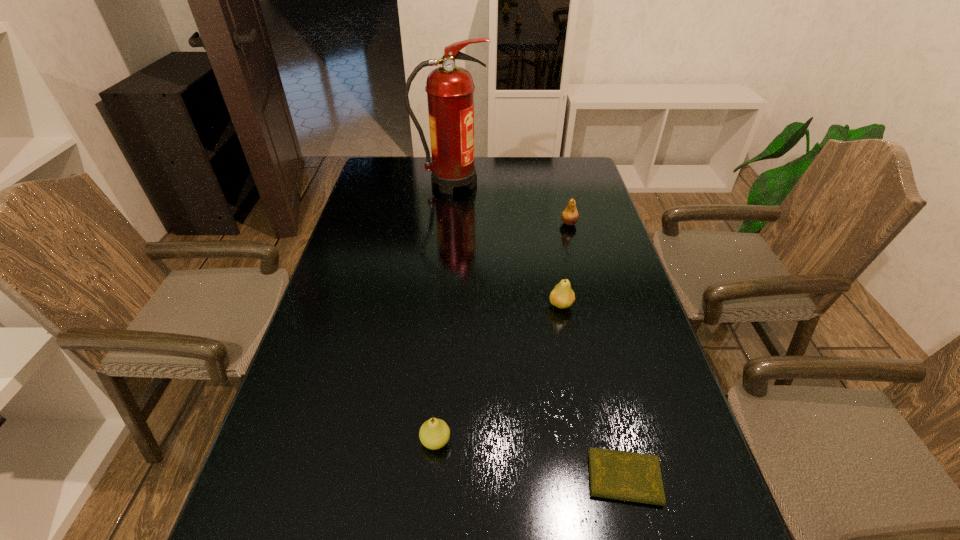
Find the location of a particular element. fire extinguisher is located at coordinates (450, 89).

At what (x,y) coordinates should I click in order to perform the action: click on the farthest object. Please return your answer as a coordinate pair (x, y). Looking at the image, I should click on (450, 89).

You are a GUI agent. You are given a task and a screenshot of the screen. Output one action in this format:
    pyautogui.click(x=<x>, y=<y>)
    Task: Click on the rightmost pear
    
    Given the screenshot: What is the action you would take?
    pyautogui.click(x=570, y=216)

This screenshot has height=540, width=960. I want to click on the second farthest object, so click(x=570, y=216).

Locate an element on the screen. This screenshot has width=960, height=540. the second pear from left to right is located at coordinates (562, 296).

Locate an element on the screen. Image resolution: width=960 pixels, height=540 pixels. the third farthest object is located at coordinates (562, 296).

This screenshot has height=540, width=960. I want to click on the nearest pear, so click(434, 433).

Image resolution: width=960 pixels, height=540 pixels. What are the coordinates of `the second shortest object` in the screenshot? It's located at (434, 433).

What are the coordinates of `diary` in the screenshot? It's located at (620, 475).

At what (x,y) coordinates should I click in order to perform the action: click on free spot located 0.210m on the front-facing side of the farthest object. Please return your answer as a coordinate pair (x, y). Looking at the image, I should click on (544, 183).